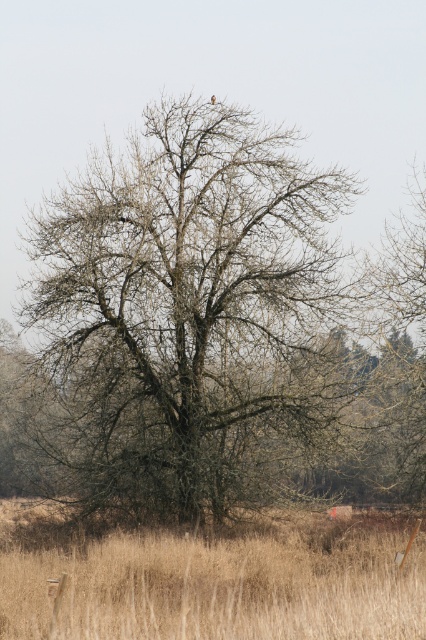
Question: Which of the following is the closest to the observer?

Choices:
 (A) brown dry grass at lower center
 (B) bare branches at center

Answer: (A)

Question: Can you confirm if bare branches at center is positioned to the right of brown dry grass at lower center?

Choices:
 (A) yes
 (B) no

Answer: (B)

Question: Is bare branches at center thinner than brown dry grass at lower center?

Choices:
 (A) yes
 (B) no

Answer: (A)

Question: Is bare branches at center to the left of brown dry grass at lower center from the viewer's perspective?

Choices:
 (A) yes
 (B) no

Answer: (A)